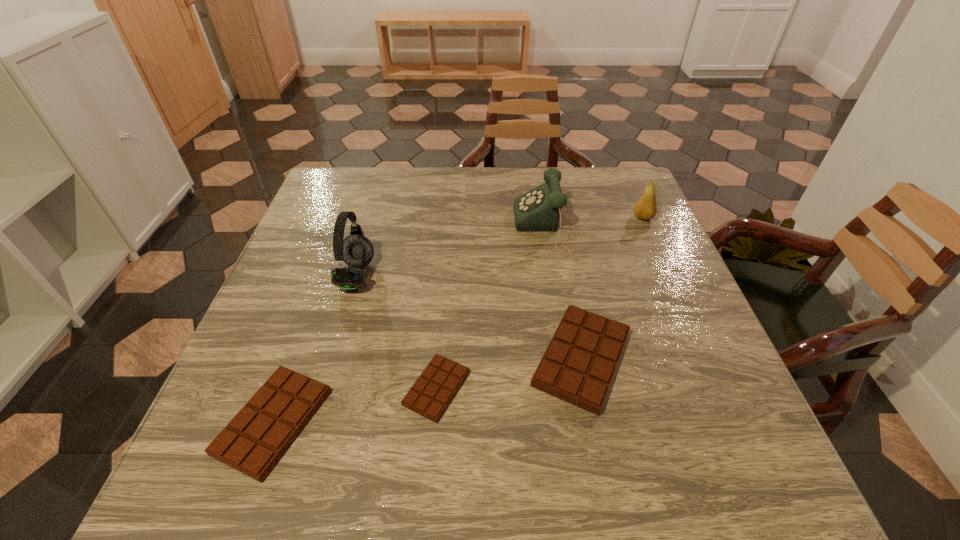
Select which candy bar is the closest to the second shortest candy bar. Please provide its 2D coordinates. Your answer should be formatted as a tuple, i.e. [(x, y)], where the tuple contains the x and y coordinates of a point satisfying the conditions above.

[(430, 395)]

The image size is (960, 540). What are the coordinates of `the second closest candy bar to the second shortest candy bar` in the screenshot? It's located at (577, 367).

The height and width of the screenshot is (540, 960). What are the coordinates of `vacant point that satisfies the following two spatial constraints: 1. on the dial of the telephone; 2. on the back side of the rightmost candy bar` in the screenshot? It's located at (568, 359).

The height and width of the screenshot is (540, 960). I want to click on free space in the image that satisfies the following two spatial constraints: 1. on the dial of the telephone; 2. on the left side of the rightmost candy bar, so click(568, 359).

Locate an element on the screen. vacant area that satisfies the following two spatial constraints: 1. on the ear cups of the fourth object from right to left; 2. on the right side of the headset is located at coordinates (324, 388).

Where is `free location that satisfies the following two spatial constraints: 1. on the dial of the rightmost candy bar; 2. on the left side of the telephone`? This screenshot has height=540, width=960. free location that satisfies the following two spatial constraints: 1. on the dial of the rightmost candy bar; 2. on the left side of the telephone is located at coordinates (568, 359).

This screenshot has height=540, width=960. Identify the location of free space in the image that satisfies the following two spatial constraints: 1. on the dial of the telephone; 2. on the front side of the leftmost candy bar. (580, 422).

This screenshot has width=960, height=540. I want to click on free space that satisfies the following two spatial constraints: 1. on the back side of the leftmost candy bar; 2. on the right side of the rightmost candy bar, so click(x=297, y=359).

Where is `free space in the image that satisfies the following two spatial constraints: 1. on the ear cups of the rightmost candy bar; 2. on the left side of the tallest object`? The height and width of the screenshot is (540, 960). free space in the image that satisfies the following two spatial constraints: 1. on the ear cups of the rightmost candy bar; 2. on the left side of the tallest object is located at coordinates (333, 359).

Identify the location of free space that satisfies the following two spatial constraints: 1. on the back side of the rightmost candy bar; 2. on the right side of the pear. The width and height of the screenshot is (960, 540). (554, 217).